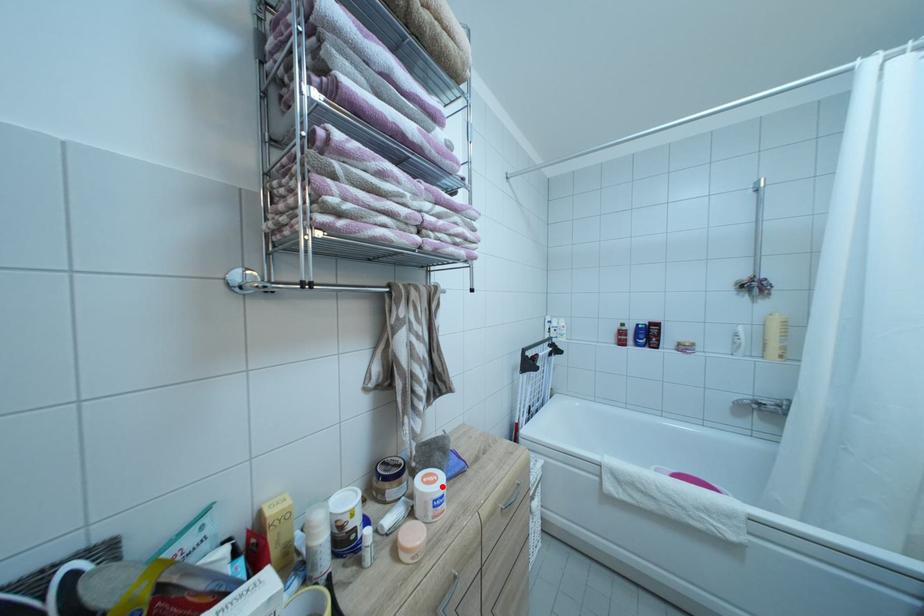
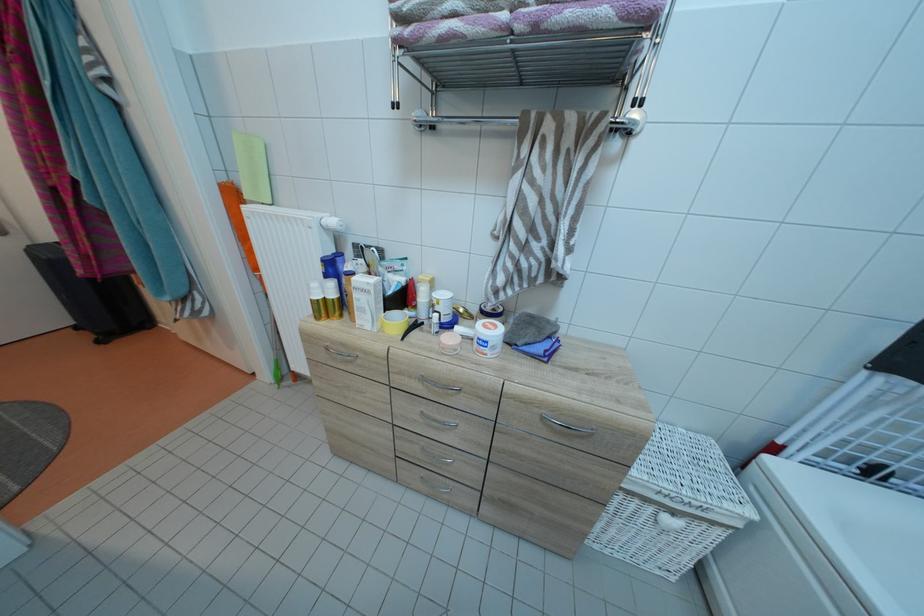
Question: I am providing you with two images of the same scene from different viewpoints. A red point is marked on the first image. At the location where the point appears in image 1, is it still visible in image 2?

Choices:
 (A) Yes
 (B) No

Answer: (A)